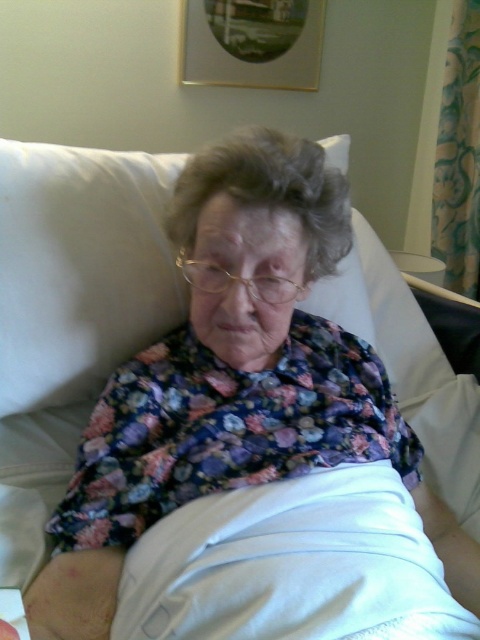
You are a caregiver entering the room and need to adjust the white fabric at center and the white fabric pillow at upper center for better comfort. Which object should you move first to ensure proper positioning?

You should move the white fabric pillow at upper center first because the white fabric at center is below it, so adjusting the pillow first allows you to position the fabric accordingly.